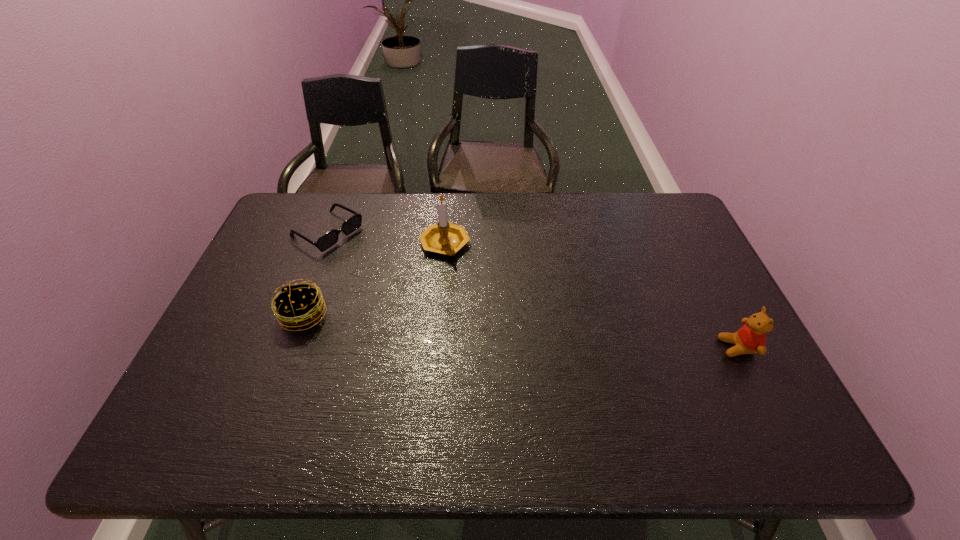
You are a GUI agent. You are given a task and a screenshot of the screen. Output one action in this format:
    pyautogui.click(x=<x>, y=<y>)
    Task: Click on the vacant space that satisfies the following two spatial constraints: 1. on the front side of the shortest object; 2. on the front-facing side of the teddy bear
    
    Given the screenshot: What is the action you would take?
    pyautogui.click(x=282, y=348)

I want to click on vacant point that satisfies the following two spatial constraints: 1. on the front side of the rightmost object; 2. on the front-facing side of the patty, so click(x=292, y=348).

Identify the location of free location that satisfies the following two spatial constraints: 1. on the front side of the shortest object; 2. on the front-facing side of the rightmost object. Image resolution: width=960 pixels, height=540 pixels. (282, 348).

Image resolution: width=960 pixels, height=540 pixels. I want to click on free space that satisfies the following two spatial constraints: 1. on the front side of the shortest object; 2. on the right side of the third object from left to right, so click(x=322, y=245).